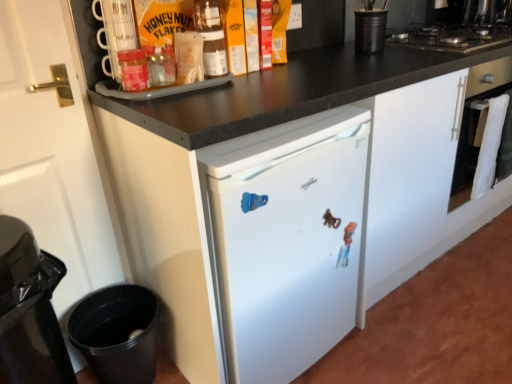
Question: Does black matte gas stove at upper right have a greater height compared to plastic toy at center?

Choices:
 (A) yes
 (B) no

Answer: (B)

Question: Could you tell me if black matte gas stove at upper right is facing plastic toy at center?

Choices:
 (A) yes
 (B) no

Answer: (B)

Question: Is black matte gas stove at upper right not within plastic toy at center?

Choices:
 (A) no
 (B) yes

Answer: (B)

Question: Does black matte gas stove at upper right have a lesser width compared to plastic toy at center?

Choices:
 (A) no
 (B) yes

Answer: (A)

Question: Considering the relative sizes of black matte gas stove at upper right and plastic toy at center in the image provided, is black matte gas stove at upper right smaller than plastic toy at center?

Choices:
 (A) yes
 (B) no

Answer: (B)

Question: Is point (352, 223) positioned closer to the camera than point (371, 34)?

Choices:
 (A) closer
 (B) farther

Answer: (A)

Question: Is plastic toy at center taller or shorter than black matte cup at upper right, marked as the second appliance in a bottom-to-top arrangement?

Choices:
 (A) tall
 (B) short

Answer: (A)

Question: From a real-world perspective, is plastic toy at center physically located above or below black matte cup at upper right, the first appliance from the top?

Choices:
 (A) below
 (B) above

Answer: (A)

Question: From the image's perspective, is plastic toy at center positioned above or below black matte cup at upper right, which is counted as the 2th appliance, starting from the left?

Choices:
 (A) above
 (B) below

Answer: (B)

Question: Is matte glass jar at upper left, placed as the 1th bottle when sorted from front to back, situated inside black plastic trash can at lower left, the first appliance positioned from the left, or outside?

Choices:
 (A) inside
 (B) outside

Answer: (B)

Question: Considering the relative positions of matte glass jar at upper left, the second bottle from the right, and black plastic trash can at lower left, arranged as the second appliance when viewed from the right, in the image provided, is matte glass jar at upper left, the second bottle from the right, to the left or to the right of black plastic trash can at lower left, arranged as the second appliance when viewed from the right,?

Choices:
 (A) left
 (B) right

Answer: (B)

Question: Considering their positions, is matte glass jar at upper left, which is the 2th bottle in top-to-bottom order, located in front of or behind black plastic trash can at lower left, the first appliance positioned from the left?

Choices:
 (A) behind
 (B) front

Answer: (B)

Question: In terms of size, does matte glass jar at upper left, placed as the 1th bottle when sorted from front to back, appear bigger or smaller than black plastic trash can at lower left, arranged as the second appliance when viewed from the right?

Choices:
 (A) small
 (B) big

Answer: (A)

Question: Considering the positions of black matte gas stove at upper right and black matte cup at upper right, which ranks as the first appliance in right-to-left order, in the image, is black matte gas stove at upper right bigger or smaller than black matte cup at upper right, which ranks as the first appliance in right-to-left order,?

Choices:
 (A) big
 (B) small

Answer: (A)

Question: Is point tap(424, 26) positioned closer to the camera than point tap(355, 31)?

Choices:
 (A) closer
 (B) farther

Answer: (B)